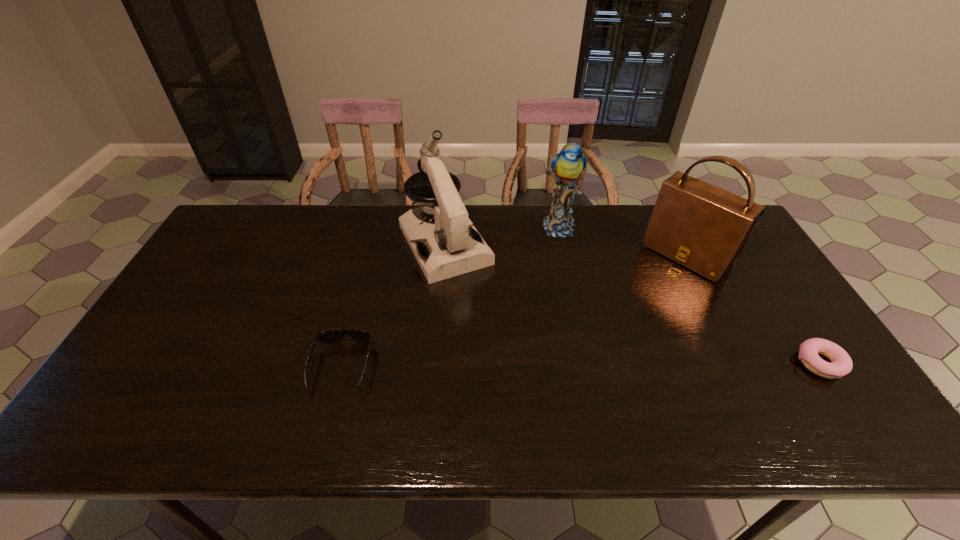
I want to click on object that is the third closest to the doughnut, so click(451, 246).

Choose which object is the fourth nearest neighbor to the shoulder bag. Please provide its 2D coordinates. Your answer should be formatted as a tuple, i.e. [(x, y)], where the tuple contains the x and y coordinates of a point satisfying the conditions above.

[(334, 335)]

Where is `vacant region that satisfies the following two spatial constraints: 1. on the front side of the third object from left to right; 2. on the right side of the shoulder bag`? The height and width of the screenshot is (540, 960). vacant region that satisfies the following two spatial constraints: 1. on the front side of the third object from left to right; 2. on the right side of the shoulder bag is located at coordinates (564, 255).

Image resolution: width=960 pixels, height=540 pixels. What are the coordinates of `free space that satisfies the following two spatial constraints: 1. on the front side of the microscope; 2. on the right side of the shoulder bag` in the screenshot? It's located at (444, 255).

This screenshot has width=960, height=540. Identify the location of free space that satisfies the following two spatial constraints: 1. on the front side of the shoulder bag; 2. on the left side of the parrot. (564, 255).

This screenshot has width=960, height=540. Find the location of `vacant area in the image that satisfies the following two spatial constraints: 1. on the front side of the parrot; 2. on the left side of the shoulder bag`. vacant area in the image that satisfies the following two spatial constraints: 1. on the front side of the parrot; 2. on the left side of the shoulder bag is located at coordinates (564, 255).